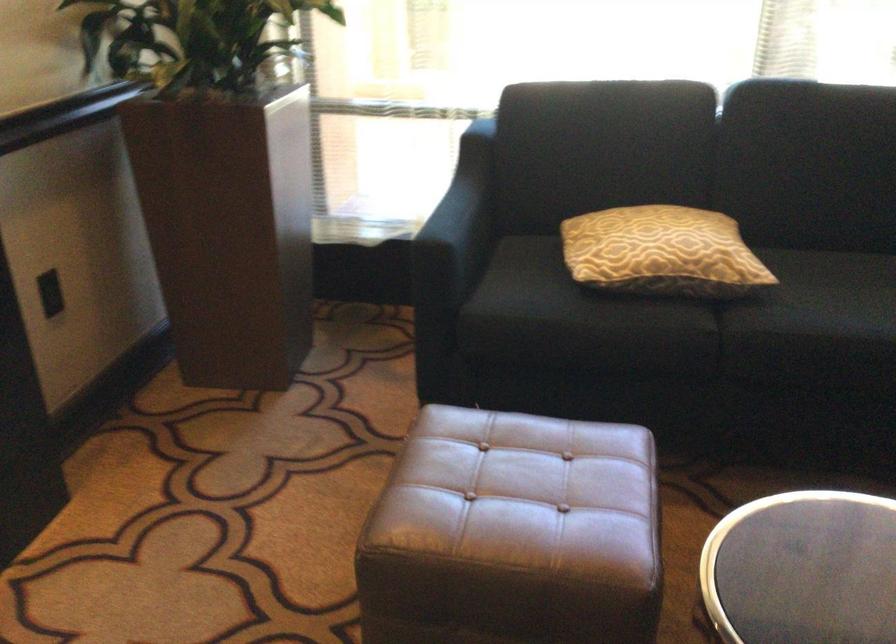
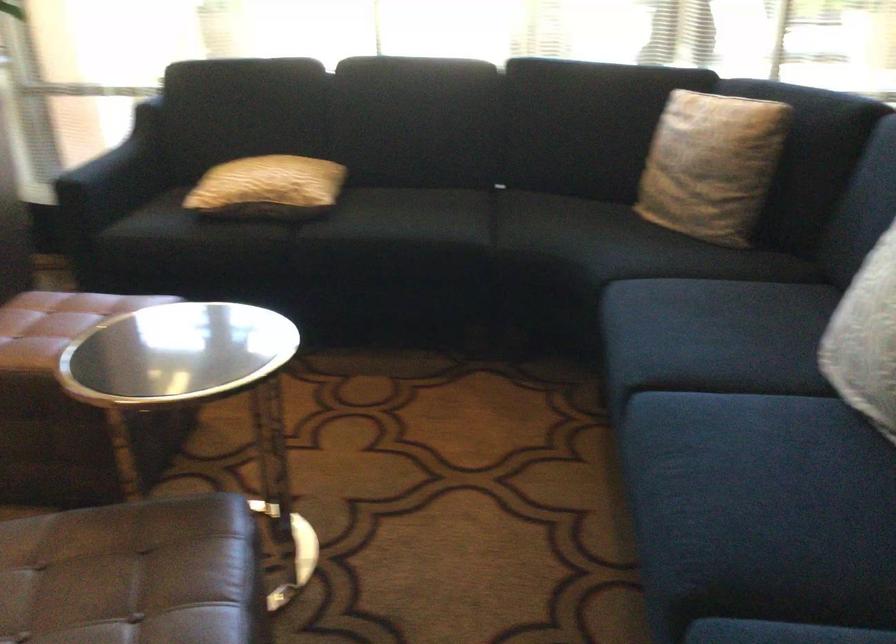
Which direction would the cameraman need to move to produce the second image?

The cameraman walked toward right, backward.